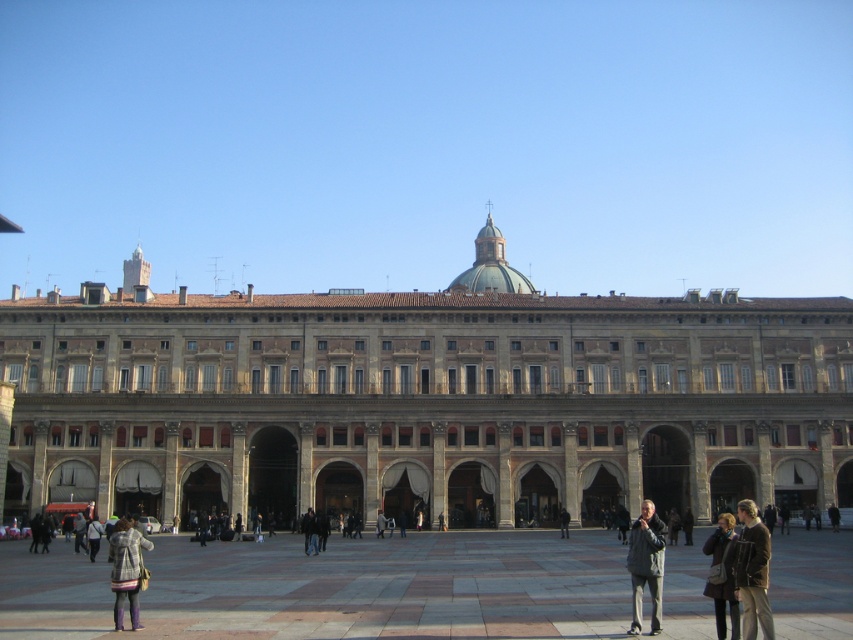
Question: Which point appears farthest from the camera in this image?

Choices:
 (A) (734, 618)
 (B) (631, 595)

Answer: (B)

Question: Which is nearer to the gray fabric jacket at lower right?

Choices:
 (A) dark gray jacket at center
 (B) dark gray wool coat at lower right
 (C) leather jacket at lower right

Answer: (B)

Question: In this image, where is leather jacket at lower right located relative to dark gray wool coat at lower right?

Choices:
 (A) above
 (B) below

Answer: (A)

Question: Is plaid fabric coat at lower left closer to the viewer compared to dark gray jacket at center?

Choices:
 (A) no
 (B) yes

Answer: (B)

Question: Is brown stone building at center wider than plaid fabric coat at lower left?

Choices:
 (A) no
 (B) yes

Answer: (B)

Question: Among these objects, which one is farthest from the camera?

Choices:
 (A) plaid fabric coat at lower left
 (B) dark gray jacket at center
 (C) brown stone building at center
 (D) smooth stone courtyard at center

Answer: (C)